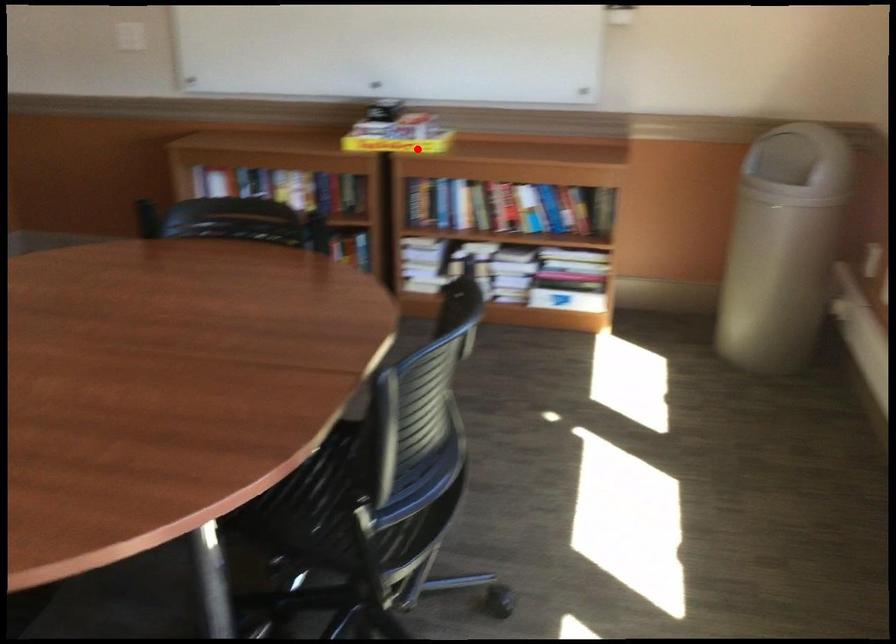
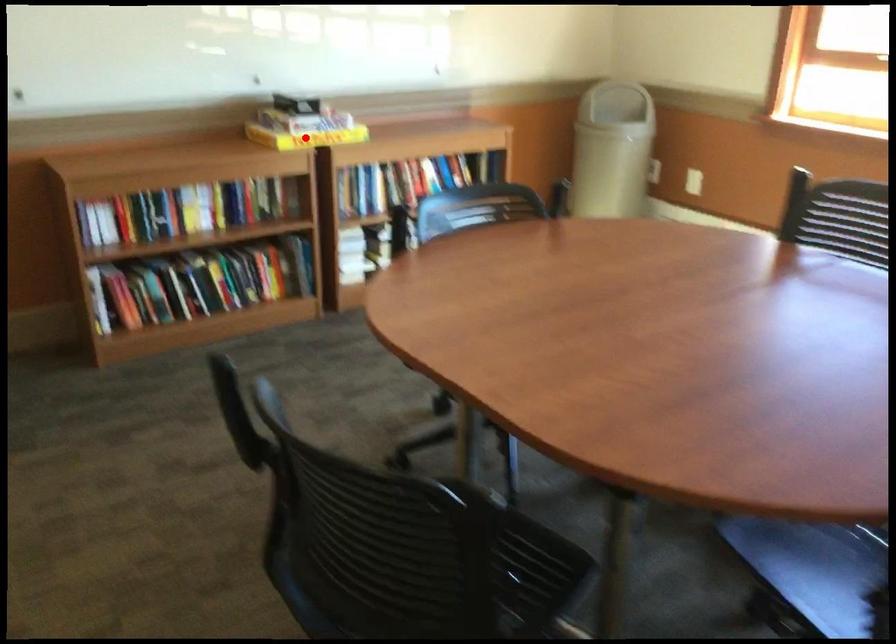
I am providing you with two images of the same scene from different viewpoints. A red point is marked on the first image and another point is marked on the second image. Are the points marked in image1 and image2 representing the same 3D position?

Yes